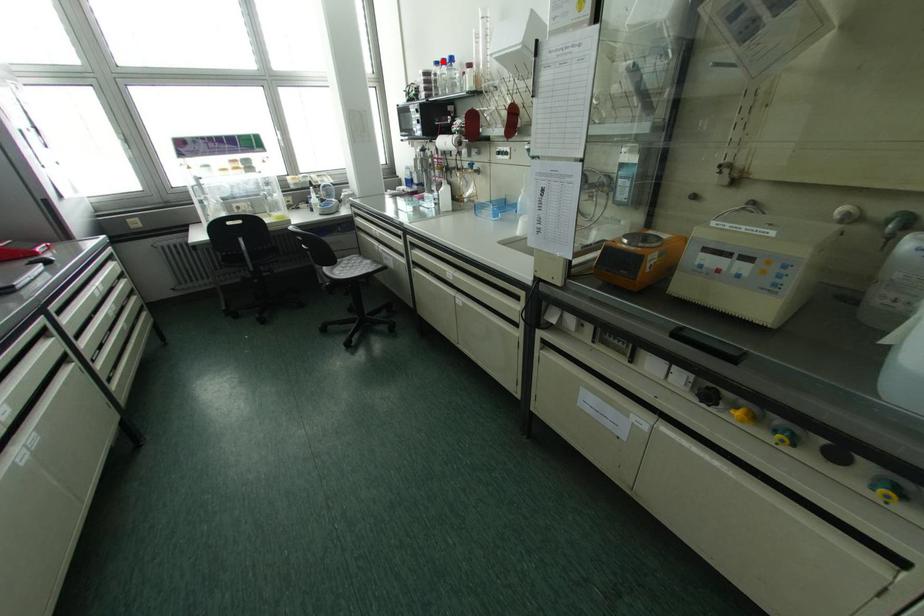
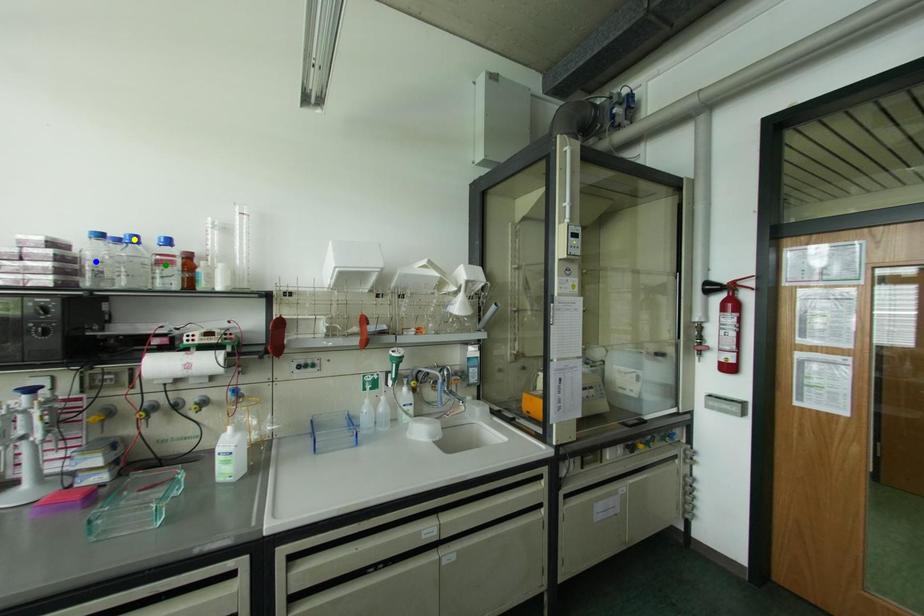
Question: I am providing you with two images of the same scene from different viewpoints. A red point is marked on the first image. You are given multiple points on the second image. Which spot in image 2 lines up with the point in image 1?

Choices:
 (A) green point
 (B) blue point
 (C) yellow point

Answer: (C)